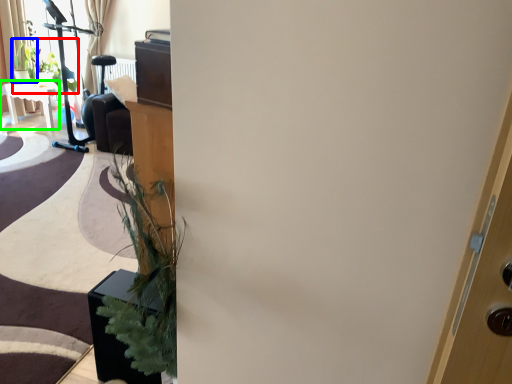
Question: Estimate the real-world distances between objects in this image. Which object is closer to plant (highlighted by a red box), plant (highlighted by a blue box) or table (highlighted by a green box)?

Choices:
 (A) plant
 (B) table

Answer: (A)